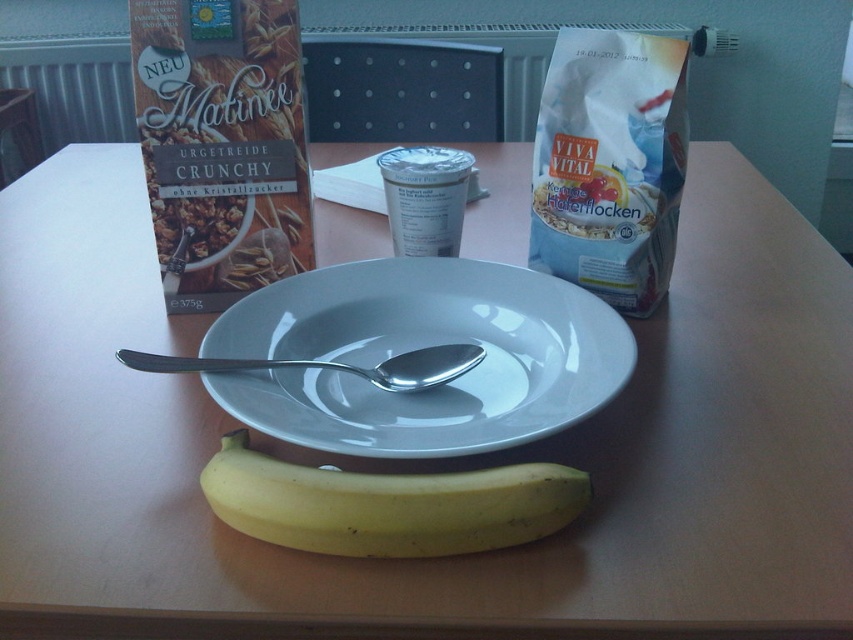
Which is more to the right, white glossy plate at center or white paper bag at upper right?

white paper bag at upper right is more to the right.

Can you confirm if white glossy plate at center is smaller than white paper bag at upper right?

No, white glossy plate at center is not smaller than white paper bag at upper right.

What do you see at coordinates (416, 348) in the screenshot? I see `white glossy plate at center` at bounding box center [416, 348].

Locate an element on the screen. The height and width of the screenshot is (640, 853). white glossy plate at center is located at coordinates (416, 348).

Which is behind, point (419, 552) or point (422, 204)?

The point (422, 204) is more distant.

Can you confirm if yellow matte banana at lower center is thinner than white matte yogurt cup at center?

Incorrect, yellow matte banana at lower center's width is not less than white matte yogurt cup at center's.

The width and height of the screenshot is (853, 640). What do you see at coordinates (387, 504) in the screenshot? I see `yellow matte banana at lower center` at bounding box center [387, 504].

You are a GUI agent. You are given a task and a screenshot of the screen. Output one action in this format:
    pyautogui.click(x=<x>, y=<y>)
    Task: Click on the yellow matte banana at lower center
    The width and height of the screenshot is (853, 640).
    Given the screenshot: What is the action you would take?
    pyautogui.click(x=387, y=504)

What do you see at coordinates (387, 504) in the screenshot? I see `yellow matte banana at lower center` at bounding box center [387, 504].

Is point (556, 483) more distant than point (447, 374)?

That is False.

The width and height of the screenshot is (853, 640). What are the coordinates of `yellow matte banana at lower center` in the screenshot? It's located at (387, 504).